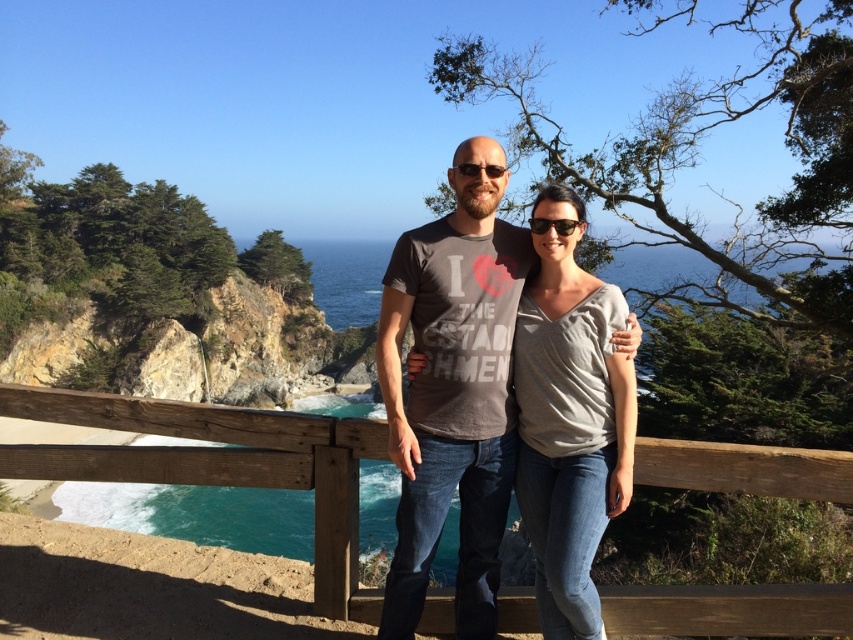
You are a photographer trying to capture the scene. You want to ensure that both the wooden at center and the gray cotton shirt at center are visible in the frame. Based on their positions, which object should you focus on first to ensure both are in focus?

The wooden at center is below the gray cotton shirt at center. To ensure both are in focus, you should focus on the gray cotton shirt at center first since it is higher up, allowing the wooden at center to be within the depth of field.